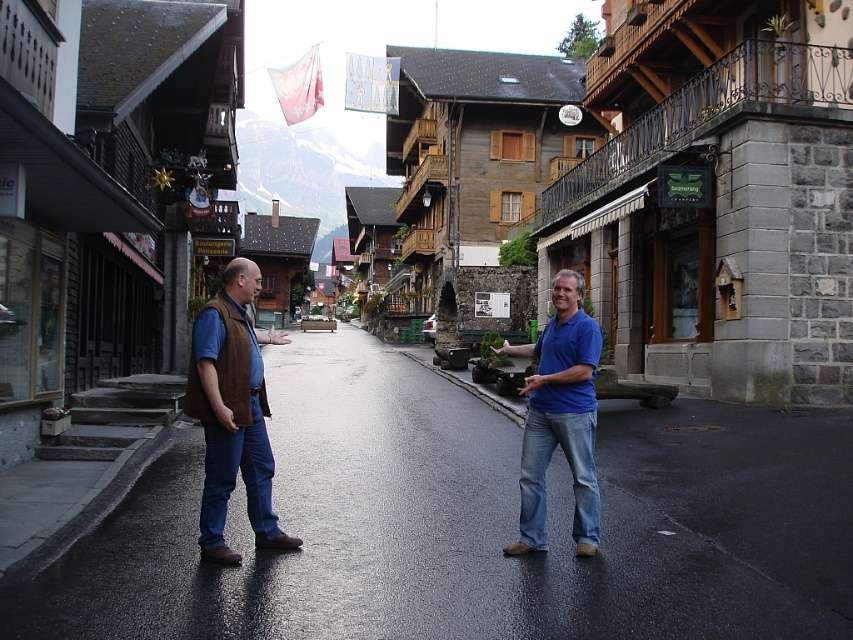
Question: Is brown suede vest at left to the right of blue denim jeans at center from the viewer's perspective?

Choices:
 (A) no
 (B) yes

Answer: (A)

Question: Which point is closer to the camera?

Choices:
 (A) blue denim jeans at center
 (B) brown suede vest at center
 (C) brown suede vest at left

Answer: (C)

Question: Does brown suede vest at center have a larger size compared to blue denim jeans at center?

Choices:
 (A) no
 (B) yes

Answer: (A)

Question: Is brown suede vest at left positioned before blue denim jeans at center?

Choices:
 (A) yes
 (B) no

Answer: (A)

Question: Which point is closer to the camera?

Choices:
 (A) brown suede vest at left
 (B) brown suede vest at center

Answer: (A)

Question: Estimate the real-world distances between objects in this image. Which object is closer to the brown suede vest at left?

Choices:
 (A) brown suede vest at center
 (B) blue denim jeans at center

Answer: (A)